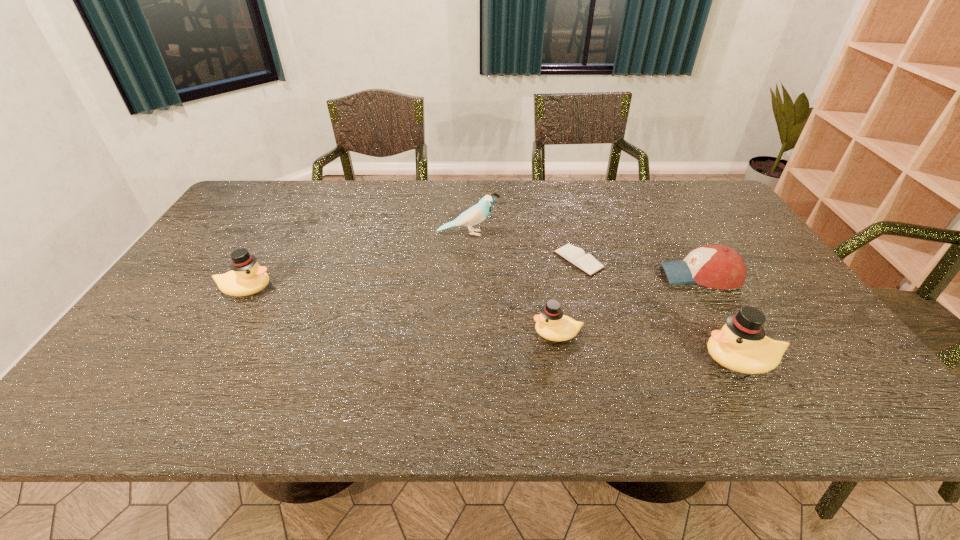
Identify the location of free space between the rightmost duck and the baseball cap. The width and height of the screenshot is (960, 540). (720, 318).

Find the location of a particular element. Image resolution: width=960 pixels, height=540 pixels. vacant area that lies between the shortest object and the rightmost duck is located at coordinates (660, 310).

At what (x,y) coordinates should I click in order to perform the action: click on vacant space that is in between the shortest duck and the bird. Please return your answer as a coordinate pair (x, y). The width and height of the screenshot is (960, 540). Looking at the image, I should click on (513, 284).

Image resolution: width=960 pixels, height=540 pixels. I want to click on free space between the shortest duck and the rightmost duck, so click(648, 347).

Locate an element on the screen. This screenshot has width=960, height=540. empty space that is in between the shortest duck and the second shortest duck is located at coordinates (401, 311).

This screenshot has width=960, height=540. I want to click on free space between the baseball cap and the tallest duck, so click(720, 318).

At what (x,y) coordinates should I click in order to perform the action: click on free spot between the baseball cap and the shortest object. Please return your answer as a coordinate pair (x, y). This screenshot has height=540, width=960. Looking at the image, I should click on (639, 268).

I want to click on free space between the farthest object and the tallest duck, so click(x=604, y=296).

The width and height of the screenshot is (960, 540). I want to click on empty space between the diary and the baseball cap, so click(639, 268).

The width and height of the screenshot is (960, 540). I want to click on free spot between the rightmost duck and the shortest duck, so click(x=648, y=347).